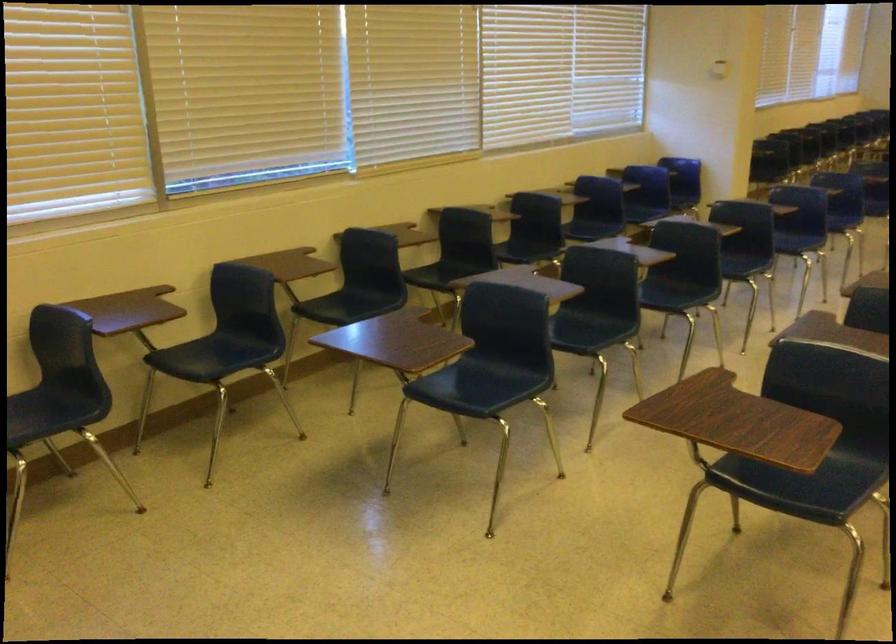
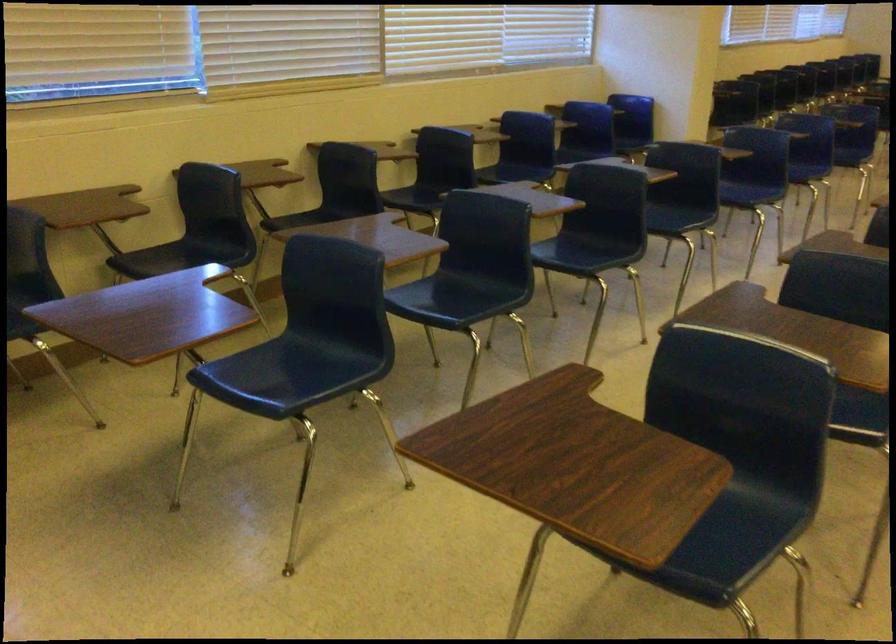
The point at (x=668, y=290) is marked in the first image. Where is the corresponding point in the second image?

(586, 252)